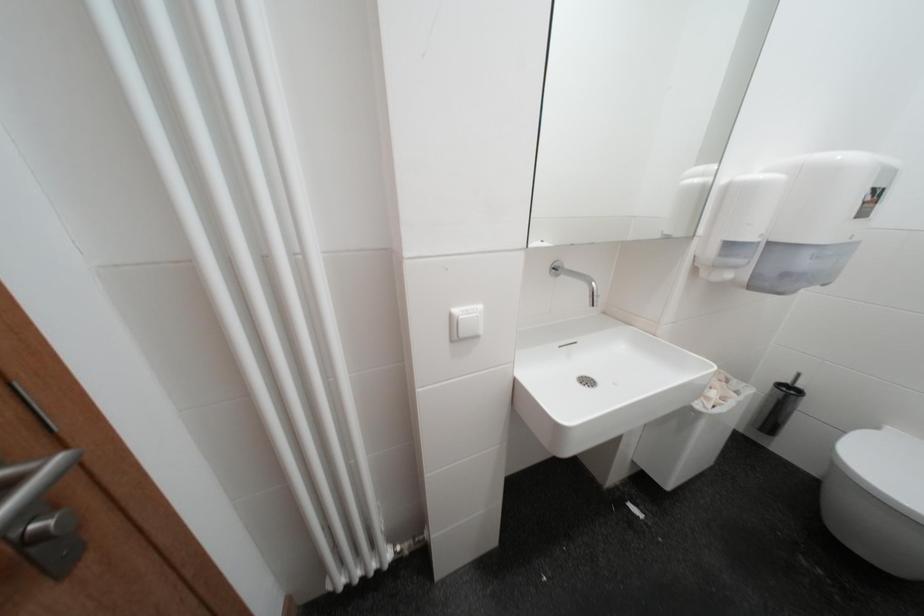
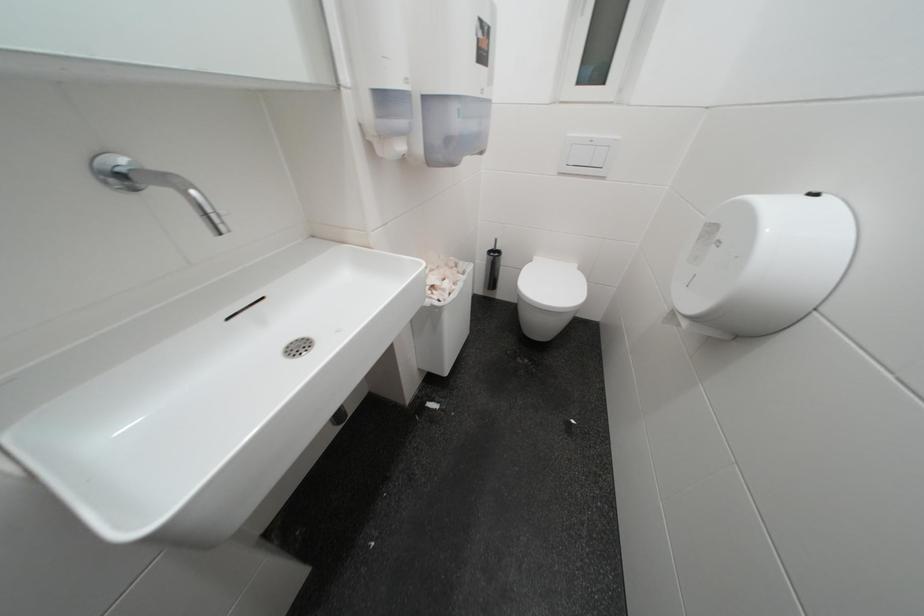
First-person continuous shooting, in which direction is the camera rotating?

The camera's rotation is toward right-down.